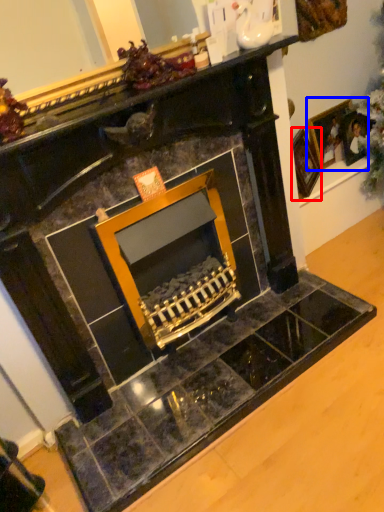
Question: Which object appears closest to the camera in this image, picture frame (highlighted by a red box) or picture frame (highlighted by a blue box)?

Choices:
 (A) picture frame
 (B) picture frame

Answer: (A)